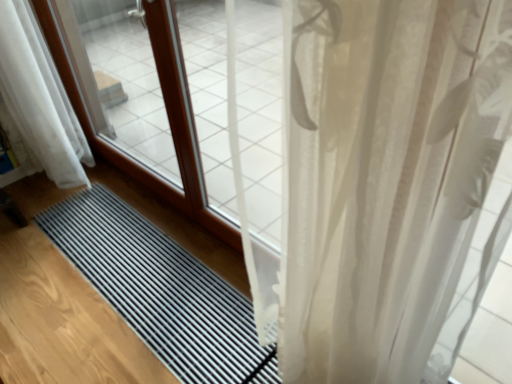
Locate an element on the screen. This screenshot has height=384, width=512. free area in between black rubber mat at center and white sheer curtain at lower left, positioned as the second curtain in front-to-back order is located at coordinates (35, 198).